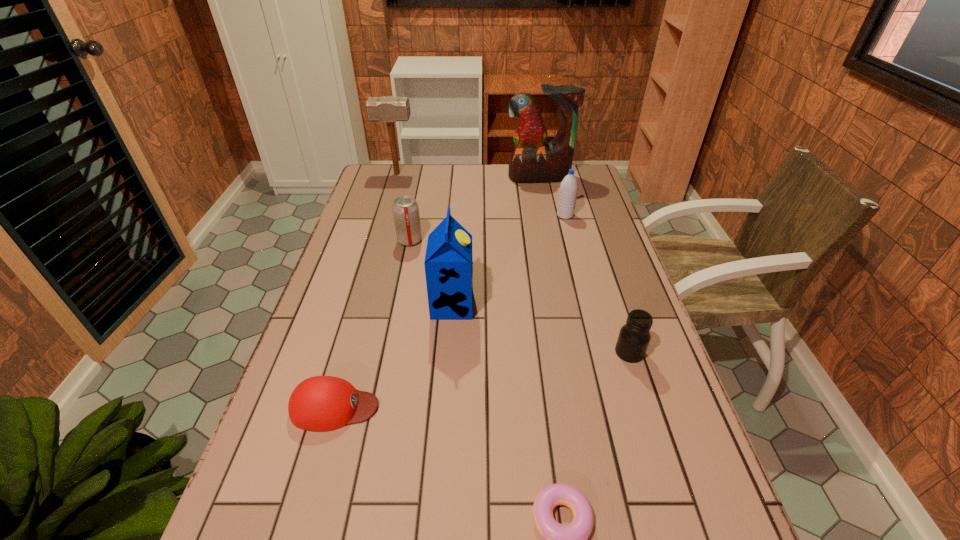
The width and height of the screenshot is (960, 540). I want to click on baseball cap, so click(321, 403).

At what (x,y) coordinates should I click in order to perform the action: click on the seventh farthest object. Please return your answer as a coordinate pair (x, y). Looking at the image, I should click on tap(321, 403).

Locate an element on the screen. free space located at the face of the tallest object is located at coordinates (552, 240).

At what (x,y) coordinates should I click in order to perform the action: click on free space located on the striking face of the mallet. Please return your answer as a coordinate pair (x, y). Looking at the image, I should click on (461, 173).

The width and height of the screenshot is (960, 540). What are the coordinates of `vacant position located 0.310m with the cap open on the carton` in the screenshot? It's located at (587, 305).

Where is `vacant space located 0.360m on the left of the fifth shortest object`? The image size is (960, 540). vacant space located 0.360m on the left of the fifth shortest object is located at coordinates (454, 215).

Identify the location of blank space located 0.100m on the right of the fourth farthest object. (453, 240).

Locate an element on the screen. vacant area situated 0.280m on the left of the sixth farthest object is located at coordinates (501, 352).

Locate an element on the screen. free location located 0.350m on the front-facing side of the seventh farthest object is located at coordinates coord(538,407).

This screenshot has width=960, height=540. Identify the location of parrot that is at the far edge. click(x=532, y=161).